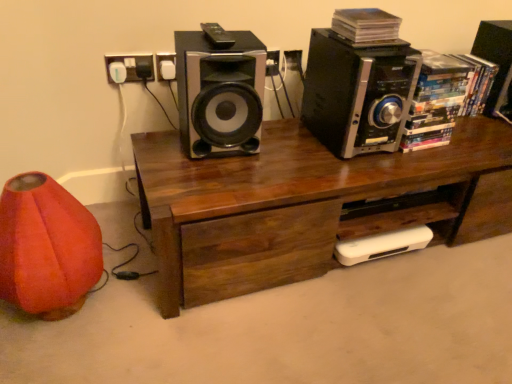
Locate an element on the screen. free space below orange fabric bean bag chair at lower left (from a real-world perspective) is located at coordinates (x=66, y=310).